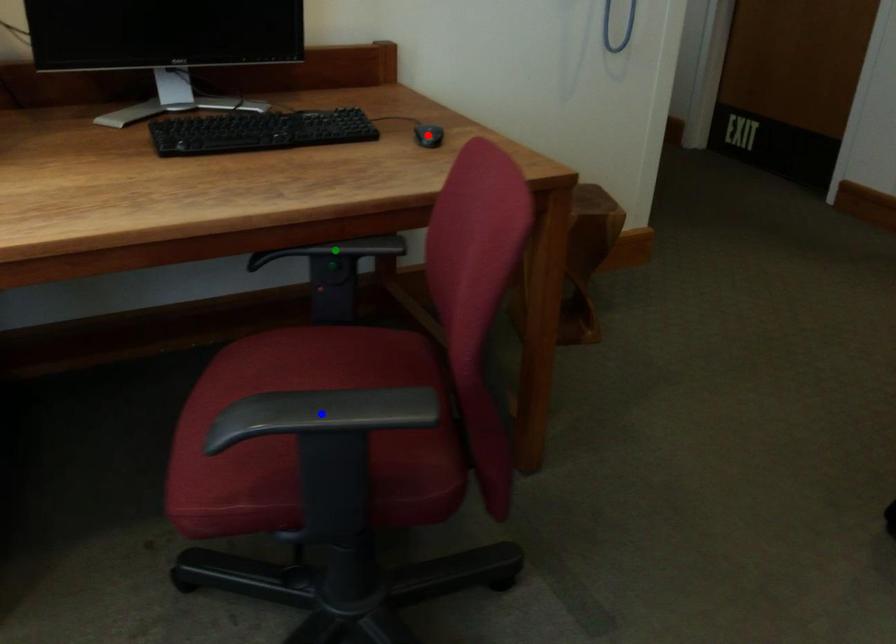
Order these from nearest to farthest:
green point, red point, blue point

blue point, green point, red point